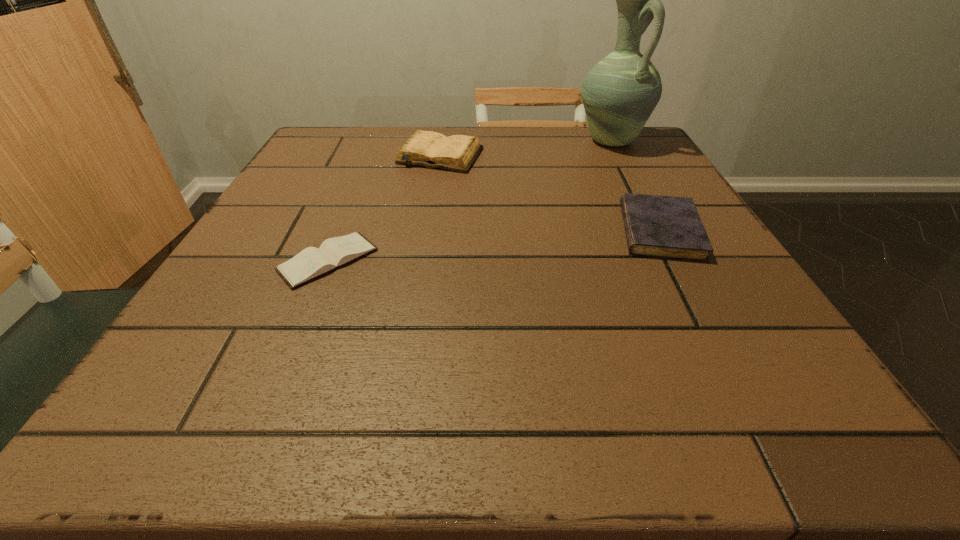
In order to click on free space that satisfies the following two spatial constraints: 1. on the handle side of the second tallest diary; 2. on the right side of the tallest object in this screenshot , I will do `click(659, 231)`.

This screenshot has height=540, width=960. What are the coordinates of `free space in the image that satisfies the following two spatial constraints: 1. on the front side of the second tallest object; 2. on the right side of the second tallest diary` in the screenshot? It's located at (429, 231).